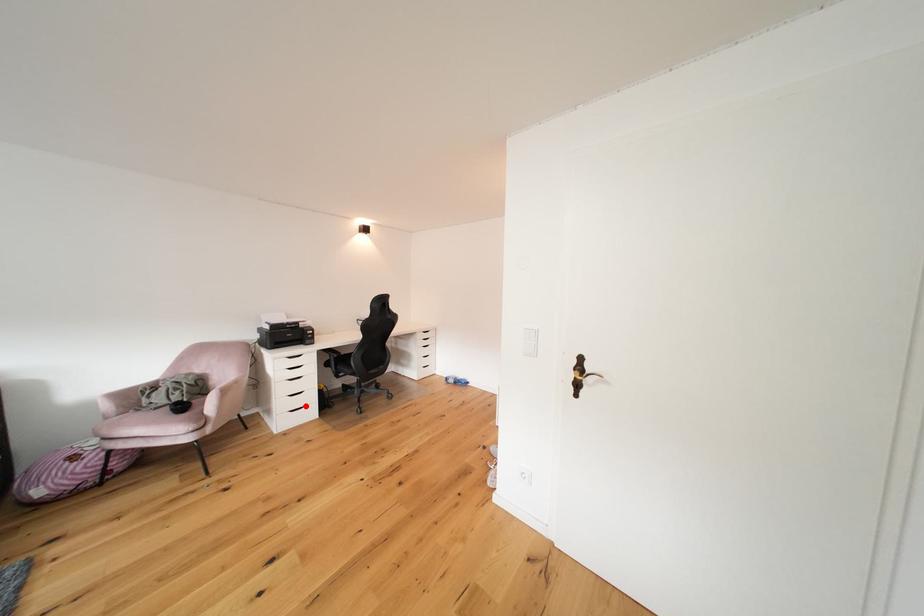
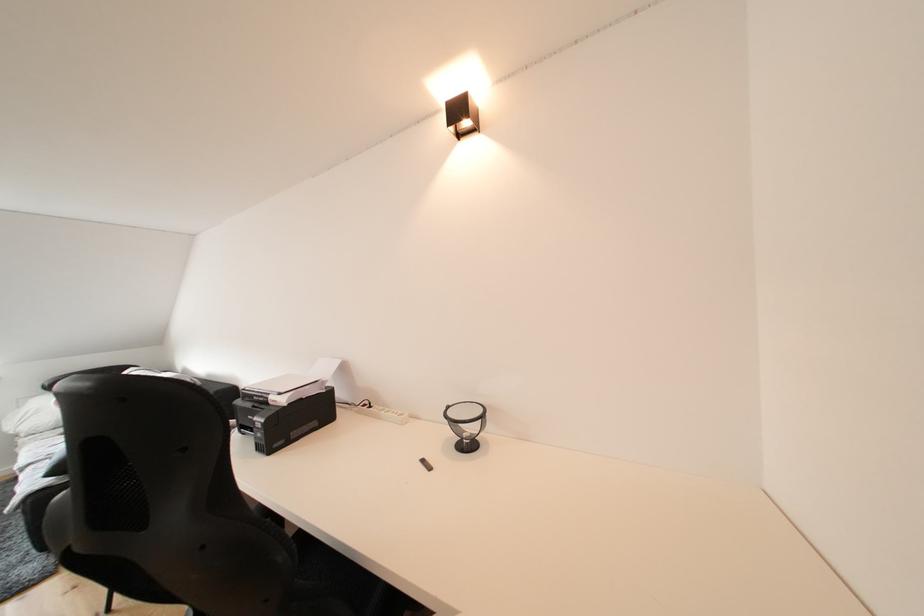
Question: I am providing you with two images of the same scene from different viewpoints. A red point is marked on the first image. Can you still see the location of the red point in image 2?

Choices:
 (A) Yes
 (B) No

Answer: (B)